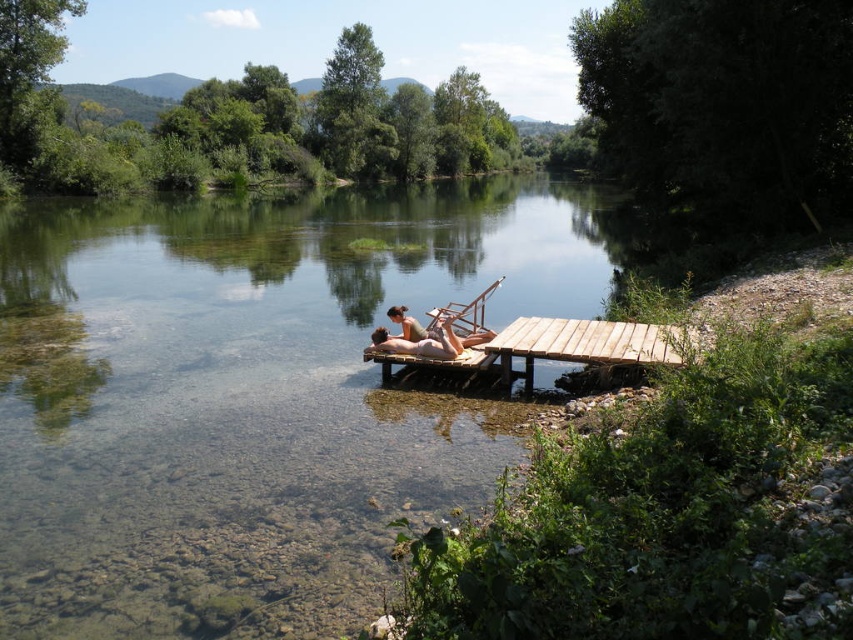
Question: From the image, what is the correct spatial relationship of wooden dock at center in relation to smooth tan skin at center?

Choices:
 (A) left
 (B) right

Answer: (B)

Question: Is clear water at center below wooden dock at center?

Choices:
 (A) yes
 (B) no

Answer: (B)

Question: Among these points, which one is nearest to the camera?

Choices:
 (A) (103, 220)
 (B) (535, 337)

Answer: (B)

Question: Considering the real-world distances, which object is farthest from the clear water at center?

Choices:
 (A) smooth tan skin at center
 (B) wooden dock at center

Answer: (A)

Question: Which object is the closest to the wooden dock at center?

Choices:
 (A) smooth tan skin at center
 (B) clear water at center

Answer: (A)

Question: Can you confirm if wooden dock at center is wider than smooth tan skin at center?

Choices:
 (A) no
 (B) yes

Answer: (B)